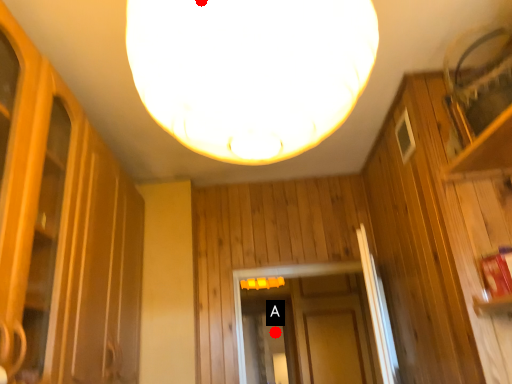
Question: Two points are circled on the image, labeled by A and B beside each circle. Which of the following is the farthest from the observer?

Choices:
 (A) A is further
 (B) B is further

Answer: (A)